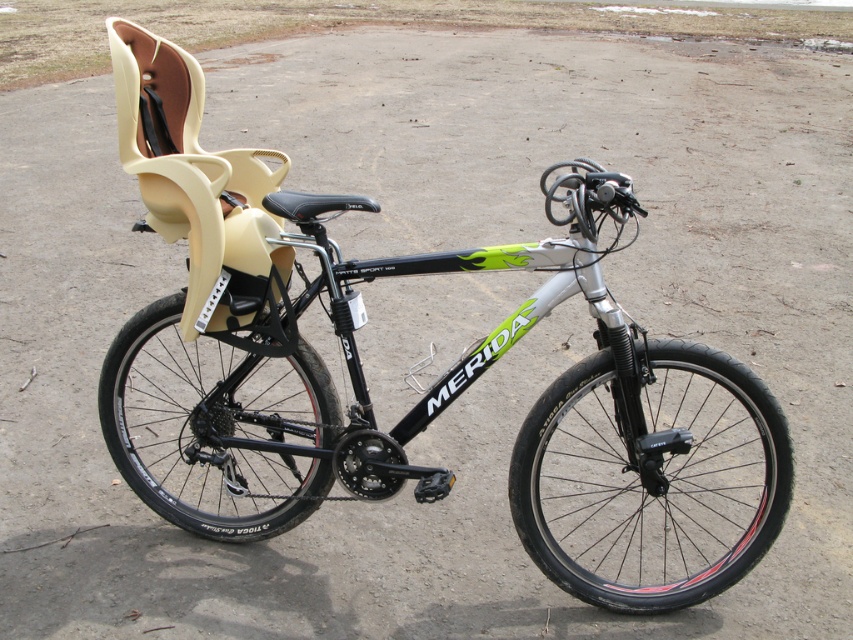
Question: In this image, where is black rubber tire at lower right located relative to black rubber tire at lower left?

Choices:
 (A) left
 (B) right

Answer: (B)

Question: Does black rubber tire at lower right have a lesser width compared to black rubber tire at lower left?

Choices:
 (A) yes
 (B) no

Answer: (B)

Question: Which point is closer to the camera?

Choices:
 (A) black rubber tire at lower left
 (B) black rubber tire at lower right

Answer: (B)

Question: Can you confirm if black rubber tire at lower right is positioned below black rubber tire at lower left?

Choices:
 (A) yes
 (B) no

Answer: (A)